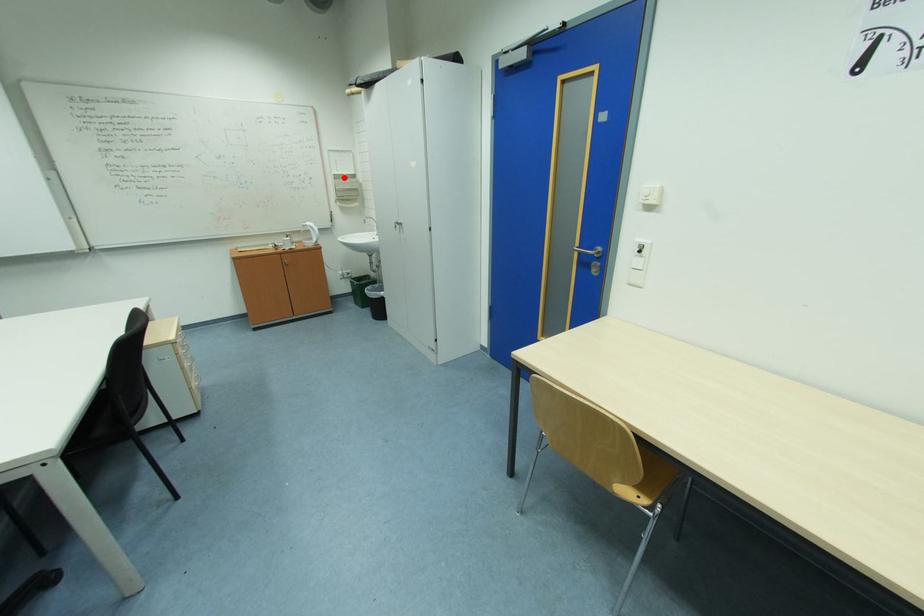
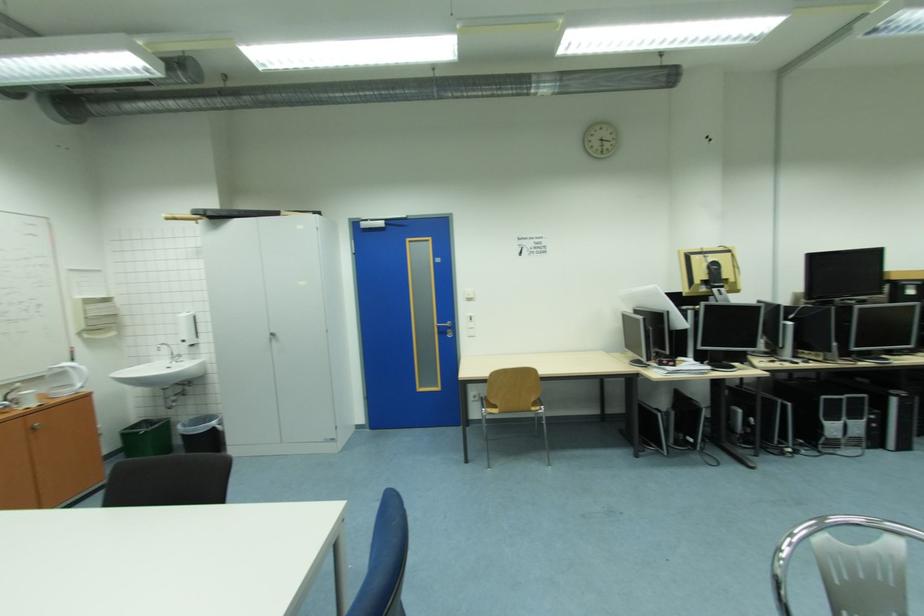
Question: I am providing you with two images of the same scene from different viewpoints. Image1 has a red point marked. In image2, the corresponding 3D location appears at what relative position? Reply with the corresponding letter.

Choices:
 (A) Closer
 (B) Farther

Answer: (B)